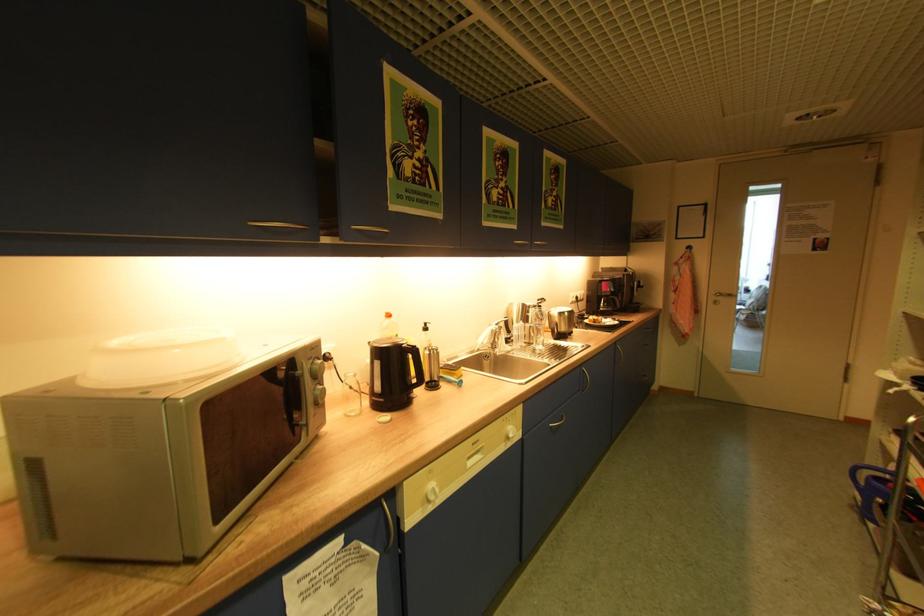
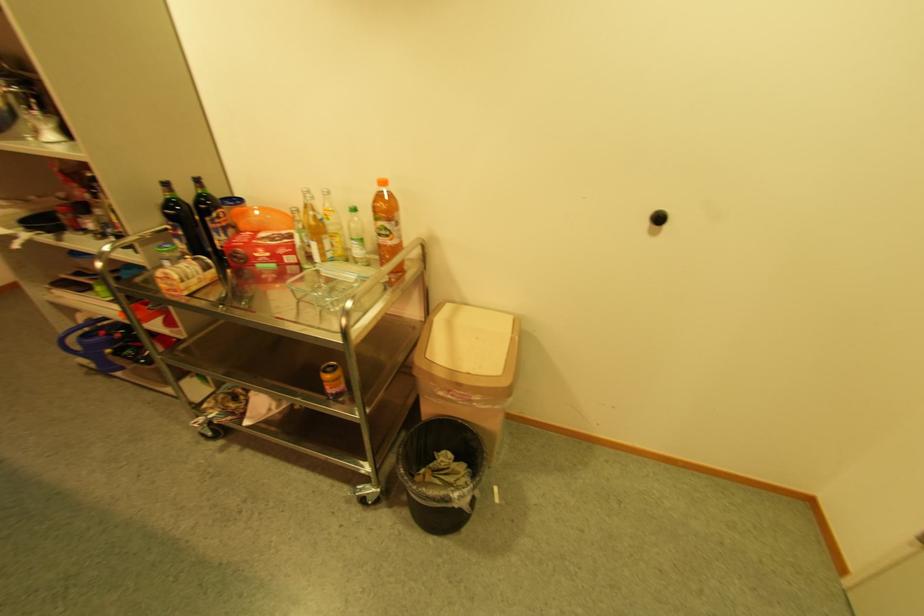
First-person continuous shooting, in which direction is the camera rotating?

The rotation direction of the camera is right-down.